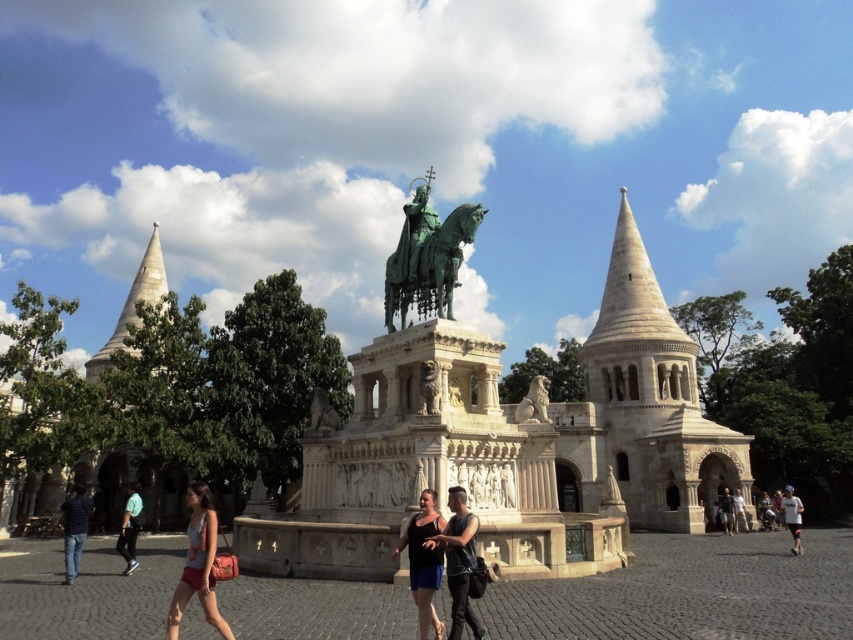
You are standing in the public square and want to take a photo of the white stone tower at center and the dark blue jeans at lower left. Which object should you position closer to the camera to ensure both are in the frame?

You should position the dark blue jeans at lower left closer to the camera since it is behind the white stone tower at center, so moving it forward will help both objects be in the frame.

You are a photographer standing in the public square with the historical monument in the background. You notice two items at the lower left corner of your viewfinder, the matte pink shorts at lower left and the dark blue jeans at lower left. Which item would appear larger in your photo?

The matte pink shorts at lower left is much taller than dark blue jeans at lower left, so it would appear larger in the photo.